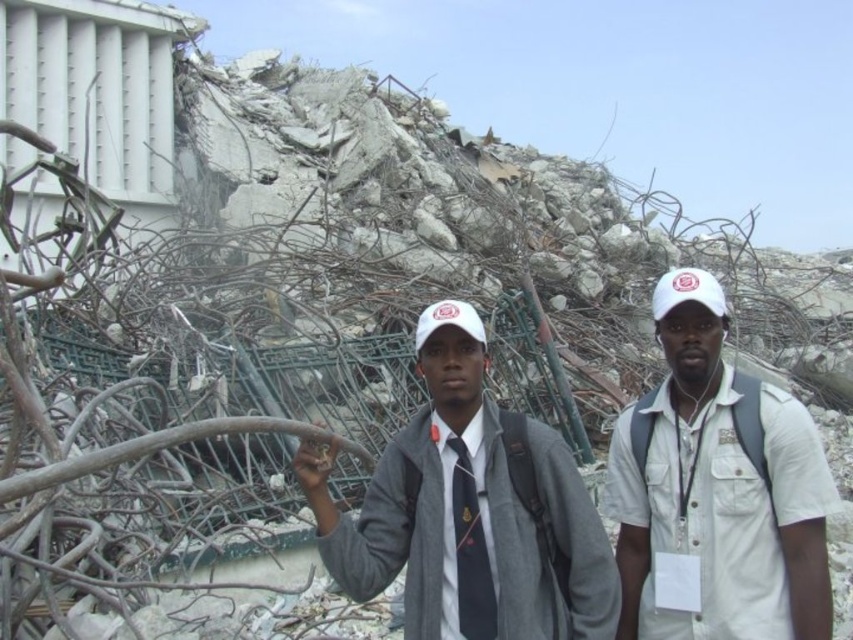
Is white cotton cap at center closer to camera compared to matte gray jacket at center?

Yes, it is in front of matte gray jacket at center.

Measure the distance between white cotton cap at center and matte gray jacket at center.

22.72 feet

Locate an element on the screen. Image resolution: width=853 pixels, height=640 pixels. white cotton cap at center is located at coordinates (717, 493).